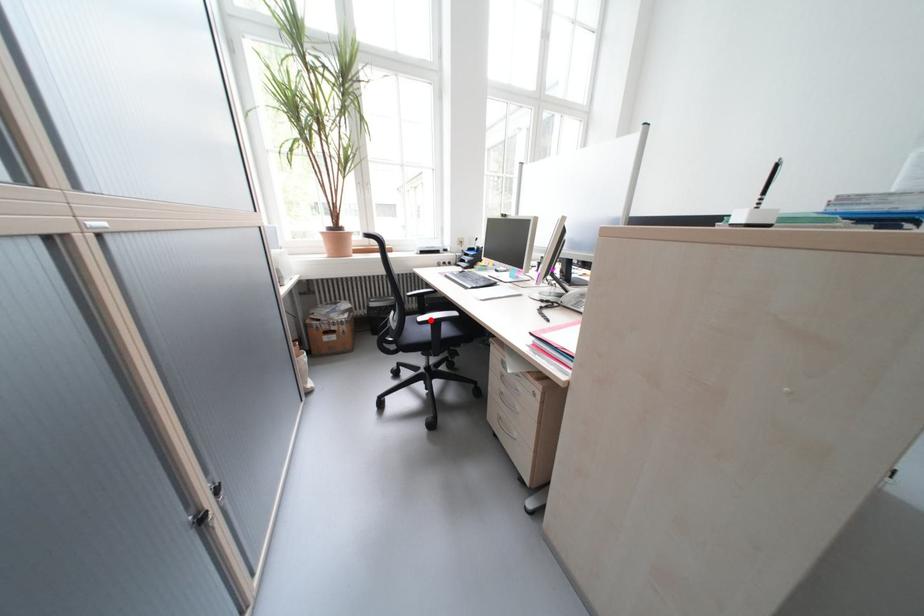
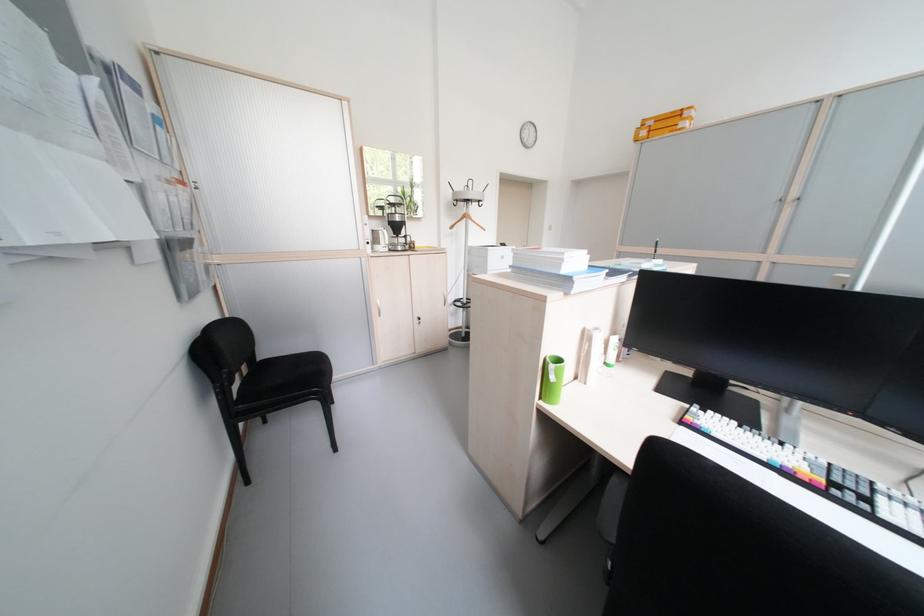
Question: I am providing you with two images of the same scene from different viewpoints. A red point is marked on the first image. Is the red point's position out of view in image 2?

Choices:
 (A) Yes
 (B) No

Answer: (A)